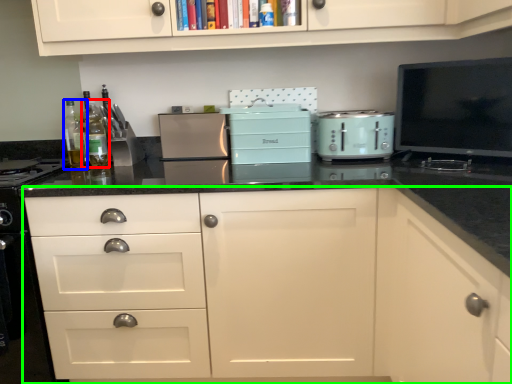
Question: Which object is positioned farthest from bottle (highlighted by a red box)? Select from bottle (highlighted by a blue box) and cabinetry (highlighted by a green box).

Choices:
 (A) bottle
 (B) cabinetry

Answer: (B)